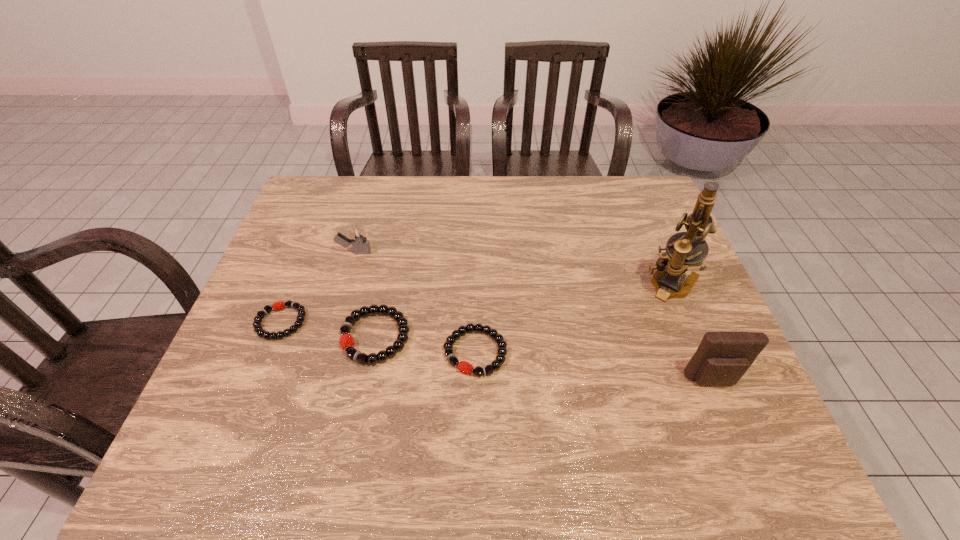
Please point a free position for a bracelet on the right. Please provide its 2D coordinates. Your answer should be formatted as a tuple, i.e. [(x, y)], where the tuple contains the x and y coordinates of a point satisfying the conditions above.

[(582, 368)]